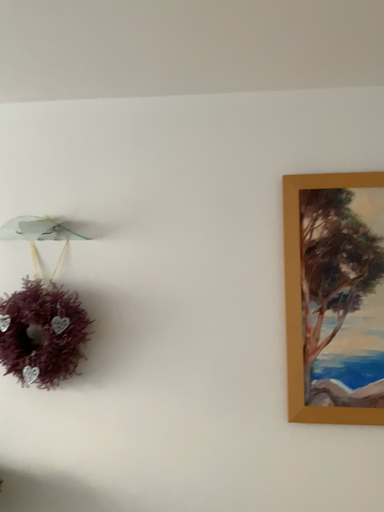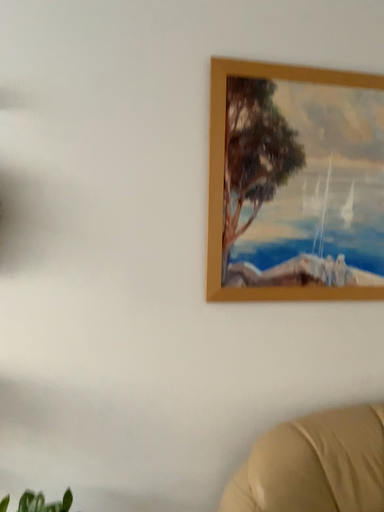
Question: How did the camera likely rotate when shooting the video?

Choices:
 (A) rotated right
 (B) rotated left

Answer: (A)